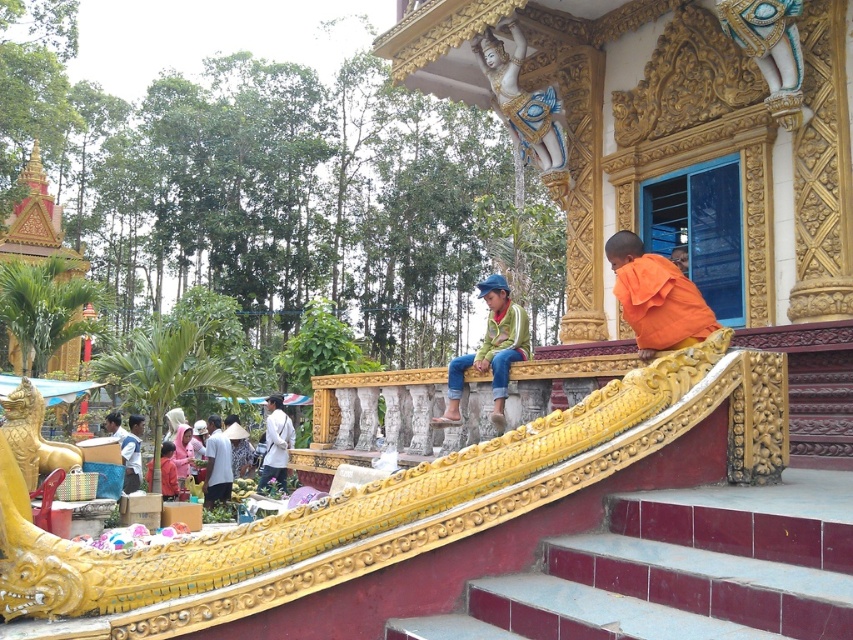
Question: Among these points, which one is farthest from the camera?

Choices:
 (A) (492, 365)
 (B) (550, 88)
 (C) (131, 488)

Answer: (C)

Question: Does green matte jacket at center have a greater width compared to gold polished statue at lower left?

Choices:
 (A) no
 (B) yes

Answer: (A)

Question: Does green matte jacket at center have a lesser width compared to gold polished statue at lower left?

Choices:
 (A) no
 (B) yes

Answer: (B)

Question: Which object is closer to the camera taking this photo?

Choices:
 (A) green matte jacket at center
 (B) orange cloth at upper right

Answer: (B)

Question: Does white glossy statue at upper center appear under light blue shirt at lower left?

Choices:
 (A) no
 (B) yes

Answer: (A)

Question: Which point is closer to the camera?

Choices:
 (A) (131, 467)
 (B) (555, 124)
 (C) (618, 298)
 (D) (498, 394)

Answer: (D)